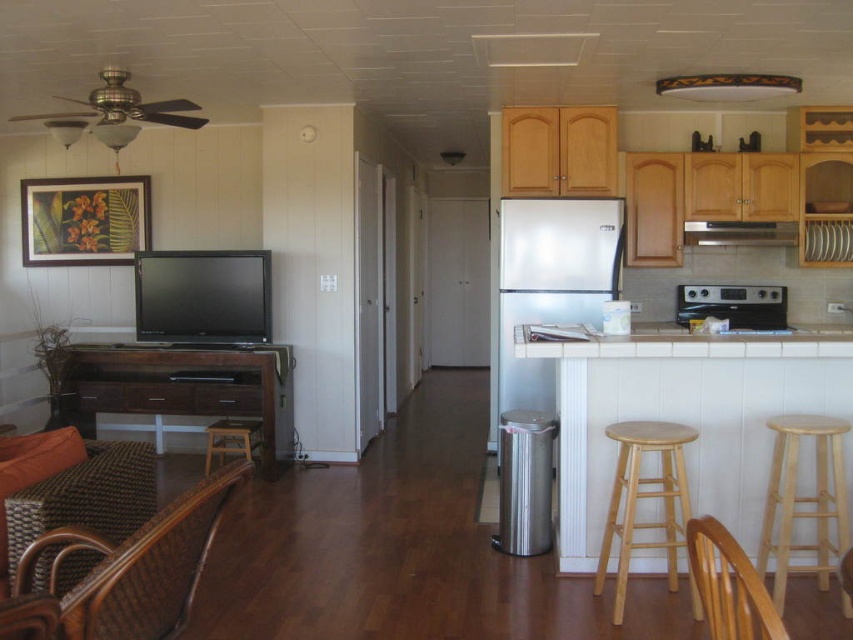
Question: Which of the following is the closest to the observer?

Choices:
 (A) white stainless steel refrigerator at center
 (B) light brown wooden stool at lower right
 (C) brown wooden chair at lower right

Answer: (C)

Question: Among these points, which one is nearest to the camera?

Choices:
 (A) (567, 321)
 (B) (241, 436)

Answer: (A)

Question: Can you confirm if woven rattan chair at lower left is thinner than stainless steel oven at right?

Choices:
 (A) yes
 (B) no

Answer: (A)

Question: Does light brown wooden stool at lower right come in front of wooden bar stool at lower center?

Choices:
 (A) yes
 (B) no

Answer: (A)

Question: Based on their relative distances, which object is nearer to the woven rattan chair at lower left?

Choices:
 (A) woven brown chair at lower left
 (B) stainless steel oven at right
 (C) light brown wooden bar stool at lower right

Answer: (A)

Question: Does matte black tv at left have a lesser width compared to light brown wooden bar stool at lower right?

Choices:
 (A) no
 (B) yes

Answer: (A)